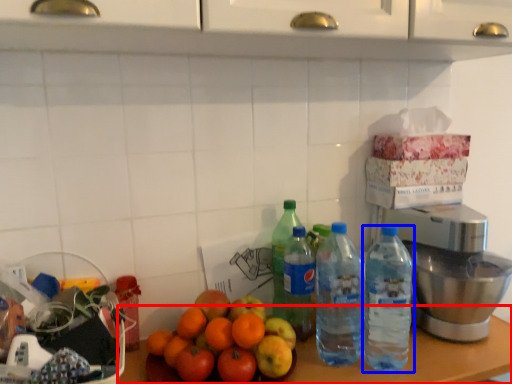
Question: Which of the following is the farthest to the observer, table (highlighted by a red box) or bottle (highlighted by a blue box)?

Choices:
 (A) table
 (B) bottle

Answer: (B)